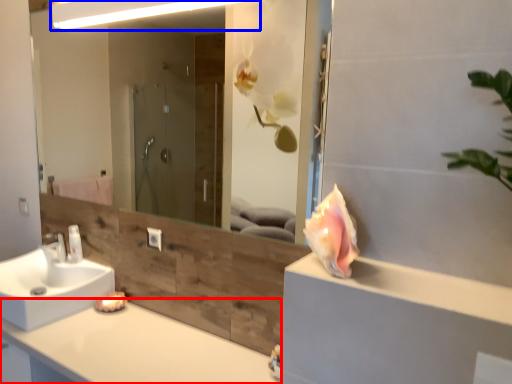
Question: Among these objects, which one is farthest to the camera, countertop (highlighted by a red box) or light fixture (highlighted by a blue box)?

Choices:
 (A) countertop
 (B) light fixture

Answer: (B)